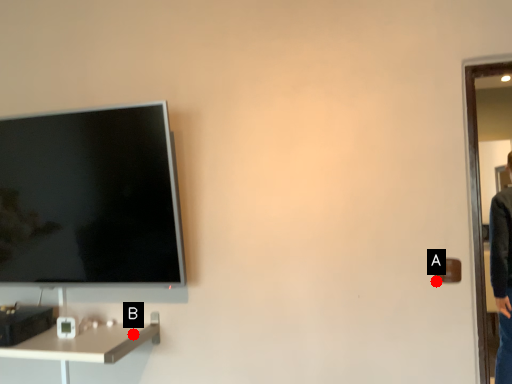
Question: Two points are circled on the image, labeled by A and B beside each circle. Which point is further to the camera?

Choices:
 (A) A is further
 (B) B is further

Answer: (B)